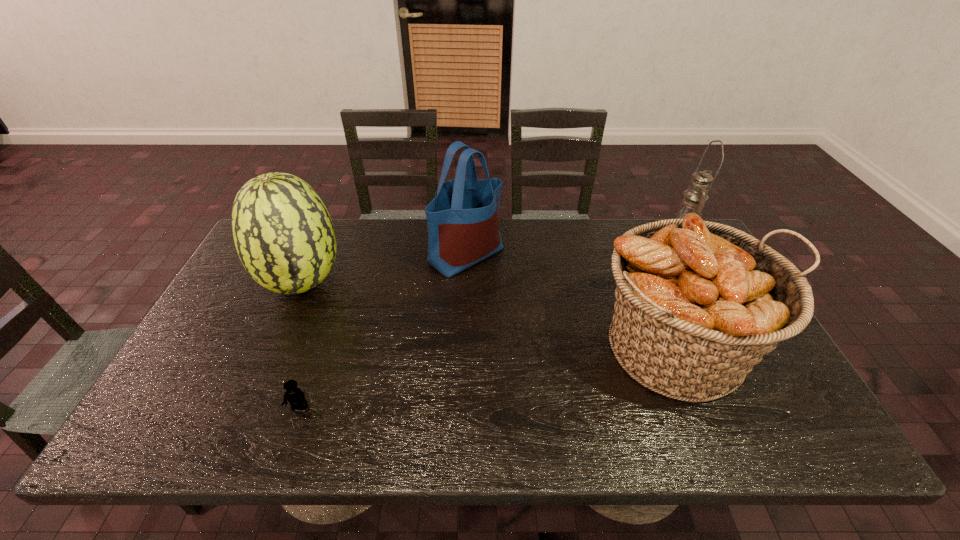
Where is `the third object from left to right`? The image size is (960, 540). the third object from left to right is located at coordinates (463, 222).

This screenshot has width=960, height=540. Find the location of `oil lamp`. oil lamp is located at coordinates (695, 196).

Find the location of `watermelon`. watermelon is located at coordinates (283, 233).

The height and width of the screenshot is (540, 960). Find the location of `basket`. basket is located at coordinates (698, 304).

The width and height of the screenshot is (960, 540). I want to click on the shortest object, so click(296, 398).

Find the location of `free space located on the right of the handbag`. free space located on the right of the handbag is located at coordinates (608, 254).

This screenshot has height=540, width=960. Identify the location of vacant space situated on the front of the oil lamp. (733, 347).

Locate an element on the screen. free space located on the front of the watermelon is located at coordinates (241, 424).

Image resolution: width=960 pixels, height=540 pixels. What are the coordinates of `free space located 0.170m on the back of the basket` in the screenshot? It's located at pos(639,255).

The width and height of the screenshot is (960, 540). Identify the location of handbag that is at the far edge. (463, 222).